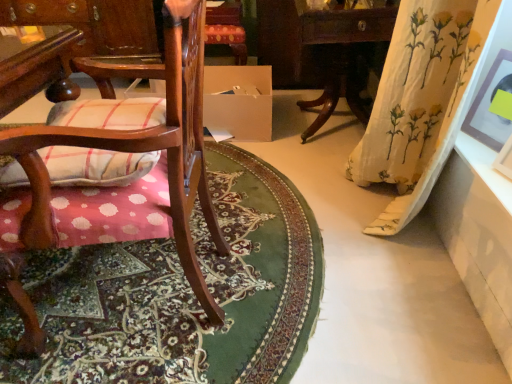
Question: Should I look upward or downward to see wooden chair with cushion at left?

Choices:
 (A) down
 (B) up

Answer: (B)

Question: Considering the relative positions of matte brown picture frame at upper right and white cardboard box at center in the image provided, is matte brown picture frame at upper right to the right of white cardboard box at center from the viewer's perspective?

Choices:
 (A) no
 (B) yes

Answer: (B)

Question: Is matte brown picture frame at upper right to the left of white cardboard box at center from the viewer's perspective?

Choices:
 (A) yes
 (B) no

Answer: (B)

Question: From a real-world perspective, is matte brown picture frame at upper right located beneath white cardboard box at center?

Choices:
 (A) no
 (B) yes

Answer: (A)

Question: Does matte brown picture frame at upper right have a larger size compared to white cardboard box at center?

Choices:
 (A) no
 (B) yes

Answer: (A)

Question: Does matte brown picture frame at upper right have a lesser width compared to white cardboard box at center?

Choices:
 (A) no
 (B) yes

Answer: (B)

Question: Is matte brown picture frame at upper right aimed at white cardboard box at center?

Choices:
 (A) yes
 (B) no

Answer: (B)

Question: Is carpeted floor mat at lower left taller than white glossy table at lower right, which is the 3th table in left-to-right order?

Choices:
 (A) no
 (B) yes

Answer: (A)

Question: Considering the relative sizes of carpeted floor mat at lower left and white glossy table at lower right, which is the 3th table in left-to-right order, in the image provided, is carpeted floor mat at lower left smaller than white glossy table at lower right, which is the 3th table in left-to-right order,?

Choices:
 (A) yes
 (B) no

Answer: (B)

Question: Is carpeted floor mat at lower left oriented away from white glossy table at lower right, the 1th table positioned from the right?

Choices:
 (A) yes
 (B) no

Answer: (B)

Question: Is carpeted floor mat at lower left located outside white glossy table at lower right, which ranks as the third table in back-to-front order?

Choices:
 (A) yes
 (B) no

Answer: (A)

Question: Is carpeted floor mat at lower left shorter than white glossy table at lower right, the 1th table when ordered from front to back?

Choices:
 (A) no
 (B) yes

Answer: (B)

Question: Considering the relative positions of carpeted floor mat at lower left and white glossy table at lower right, which ranks as the third table in back-to-front order, in the image provided, is carpeted floor mat at lower left to the right of white glossy table at lower right, which ranks as the third table in back-to-front order, from the viewer's perspective?

Choices:
 (A) no
 (B) yes

Answer: (A)

Question: Is wooden table at left, which is the first table from back to front, oriented away from wooden table at right, acting as the 2th table starting from the back?

Choices:
 (A) yes
 (B) no

Answer: (B)